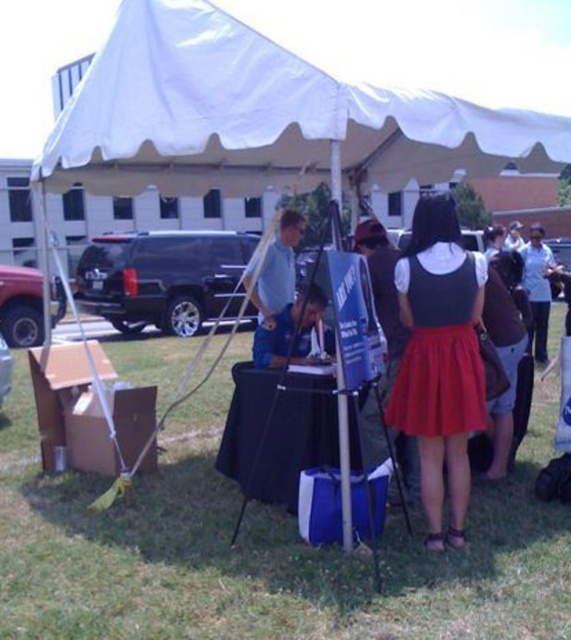
Question: Which of these objects is positioned closest to the red satin dress at center?

Choices:
 (A) white fabric canopy at upper center
 (B) green grass at lower center

Answer: (B)

Question: Can you confirm if green grass at lower center is thinner than white fabric canopy at upper center?

Choices:
 (A) yes
 (B) no

Answer: (A)

Question: Does green grass at lower center appear under white fabric canopy at upper center?

Choices:
 (A) no
 (B) yes

Answer: (B)

Question: Which of these objects is positioned farthest from the white fabric canopy at upper center?

Choices:
 (A) green grass at lower center
 (B) red satin dress at center

Answer: (A)

Question: Which of the following is the closest to the observer?

Choices:
 (A) (329, 115)
 (B) (441, 252)
 (C) (143, 620)

Answer: (C)

Question: Does white fabric canopy at upper center have a greater width compared to red satin dress at center?

Choices:
 (A) yes
 (B) no

Answer: (A)